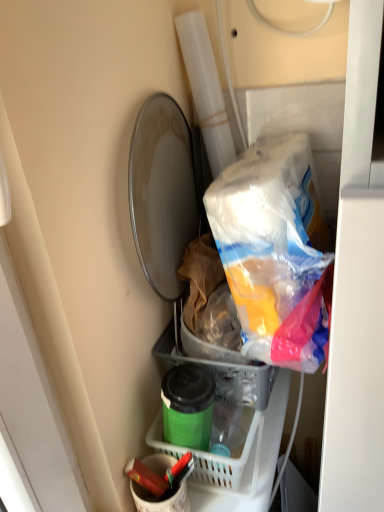
Question: From a real-world perspective, does matte red crayon at lower center stand above matte white bucket at lower center?

Choices:
 (A) no
 (B) yes

Answer: (B)

Question: From the image's perspective, is matte red crayon at lower center below matte white bucket at lower center?

Choices:
 (A) yes
 (B) no

Answer: (B)

Question: Can you confirm if matte red crayon at lower center is wider than matte white bucket at lower center?

Choices:
 (A) no
 (B) yes

Answer: (A)

Question: Is matte red crayon at lower center facing away from matte white bucket at lower center?

Choices:
 (A) yes
 (B) no

Answer: (A)

Question: Are matte red crayon at lower center and matte white bucket at lower center located far from each other?

Choices:
 (A) yes
 (B) no

Answer: (B)

Question: Considering the relative positions of green matte container at lower center and matte white bucket at lower center in the image provided, is green matte container at lower center to the left or to the right of matte white bucket at lower center?

Choices:
 (A) right
 (B) left

Answer: (A)

Question: Looking at their shapes, would you say green matte container at lower center is wider or thinner than matte white bucket at lower center?

Choices:
 (A) thin
 (B) wide

Answer: (B)

Question: From a real-world perspective, relative to matte white bucket at lower center, is green matte container at lower center vertically above or below?

Choices:
 (A) below
 (B) above

Answer: (B)

Question: In terms of height, does green matte container at lower center look taller or shorter compared to matte white bucket at lower center?

Choices:
 (A) tall
 (B) short

Answer: (A)

Question: Is green matte container at lower center taller or shorter than green plastic basket at lower center?

Choices:
 (A) short
 (B) tall

Answer: (B)

Question: Is green matte container at lower center to the left or to the right of green plastic basket at lower center in the image?

Choices:
 (A) right
 (B) left

Answer: (B)

Question: Is green matte container at lower center situated inside green plastic basket at lower center or outside?

Choices:
 (A) outside
 (B) inside

Answer: (A)

Question: In terms of width, does green matte container at lower center look wider or thinner when compared to green plastic basket at lower center?

Choices:
 (A) thin
 (B) wide

Answer: (A)

Question: Is green matte container at lower center wider or thinner than matte red crayon at lower center?

Choices:
 (A) thin
 (B) wide

Answer: (B)

Question: From a real-world perspective, is green matte container at lower center above or below matte red crayon at lower center?

Choices:
 (A) below
 (B) above

Answer: (B)